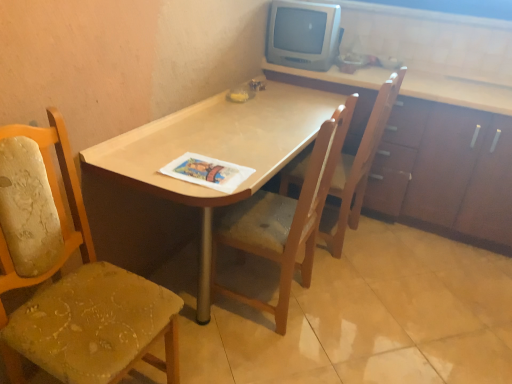
Identify the location of wooden chair at center, the third chair viewed from the left. (360, 164).

The width and height of the screenshot is (512, 384). I want to click on light wood desk at center, so click(x=215, y=152).

What do you see at coordinates (207, 172) in the screenshot? I see `printed paper magazine at center` at bounding box center [207, 172].

At what (x,y) coordinates should I click in order to perform the action: click on wooden chair at center, which is the 2th chair from left to right. Please return your answer as a coordinate pair (x, y). The width and height of the screenshot is (512, 384). Looking at the image, I should click on [285, 220].

Find the location of a particular element. The image size is (512, 384). wooden chair at center, the third chair viewed from the left is located at coordinates (360, 164).

Consider the image. Is light wood desk at center oriented away from worn fabric chair at left, which appears as the 1th chair when viewed from the left?

No, worn fabric chair at left, which appears as the 1th chair when viewed from the left, is not at the back of light wood desk at center.

Can you confirm if light wood desk at center is shorter than worn fabric chair at left, which appears as the 1th chair when viewed from the left?

Yes.

Which is correct: light wood desk at center is inside worn fabric chair at left, which appears as the 1th chair when viewed from the left, or outside of it?

light wood desk at center lies outside worn fabric chair at left, which appears as the 1th chair when viewed from the left.

Between wooden chair at center, which is counted as the second chair, starting from the right, and printed paper magazine at center, which one has smaller size?

Smaller between the two is printed paper magazine at center.

Where is `chair that is the 1st object located below the printed paper magazine at center (from the image's perspective)`? chair that is the 1st object located below the printed paper magazine at center (from the image's perspective) is located at coordinates pyautogui.click(x=285, y=220).

From a real-world perspective, which object rests below the other?

A: wooden chair at center, which is the 2th chair from left to right, is physically lower.

Is wooden chair at center, which is the 2th chair from left to right, positioned beyond the bounds of printed paper magazine at center?

Yes.

Consider the image. Does printed paper magazine at center come in front of wooden chair at center, placed as the 1th chair when sorted from right to left?

That is True.

The image size is (512, 384). I want to click on magazine that appears above the wooden chair at center, placed as the 1th chair when sorted from right to left (from a real-world perspective), so click(x=207, y=172).

Can you tell me how much printed paper magazine at center and wooden chair at center, the third chair viewed from the left, differ in facing direction?

The angular difference between printed paper magazine at center and wooden chair at center, the third chair viewed from the left, is 176 degrees.

Which is behind, point (383, 91) or point (226, 162)?

Positioned behind is point (383, 91).

Is printed paper magazine at center located within wooden chair at center, placed as the 1th chair when sorted from right to left?

No, printed paper magazine at center is located outside of wooden chair at center, placed as the 1th chair when sorted from right to left.

Can you confirm if wooden chair at center, the third chair viewed from the left, is positioned to the right of printed paper magazine at center?

Indeed, wooden chair at center, the third chair viewed from the left, is positioned on the right side of printed paper magazine at center.

Does wooden chair at center, the third chair viewed from the left, have a greater width compared to printed paper magazine at center?

Yes, wooden chair at center, the third chair viewed from the left, is wider than printed paper magazine at center.

Is worn fabric chair at left, which appears as the 1th chair when viewed from the left, aimed at wooden chair at center, which is the 2th chair from left to right?

No, worn fabric chair at left, which appears as the 1th chair when viewed from the left, is not turned towards wooden chair at center, which is the 2th chair from left to right.

Considering the points (100, 356) and (265, 248), which point is behind, point (100, 356) or point (265, 248)?

The point (265, 248) is behind.

Considering the positions of objects worn fabric chair at left, which is the 3th chair in right-to-left order, and wooden chair at center, which is the 2th chair from left to right, in the image provided, who is in front, worn fabric chair at left, which is the 3th chair in right-to-left order, or wooden chair at center, which is the 2th chair from left to right,?

Positioned in front is worn fabric chair at left, which is the 3th chair in right-to-left order.

Considering the sizes of objects worn fabric chair at left, which appears as the 1th chair when viewed from the left, and wooden chair at center, which is the 2th chair from left to right, in the image provided, who is smaller, worn fabric chair at left, which appears as the 1th chair when viewed from the left, or wooden chair at center, which is the 2th chair from left to right,?

worn fabric chair at left, which appears as the 1th chair when viewed from the left.

Considering the relative sizes of printed paper magazine at center and worn fabric chair at left, which is the 3th chair in right-to-left order, in the image provided, is printed paper magazine at center smaller than worn fabric chair at left, which is the 3th chair in right-to-left order,?

Indeed, printed paper magazine at center has a smaller size compared to worn fabric chair at left, which is the 3th chair in right-to-left order.

From the image's perspective, which is below, printed paper magazine at center or worn fabric chair at left, which is the 3th chair in right-to-left order?

worn fabric chair at left, which is the 3th chair in right-to-left order.

Considering the relative sizes of printed paper magazine at center and worn fabric chair at left, which appears as the 1th chair when viewed from the left, in the image provided, is printed paper magazine at center shorter than worn fabric chair at left, which appears as the 1th chair when viewed from the left,?

Indeed, printed paper magazine at center has a lesser height compared to worn fabric chair at left, which appears as the 1th chair when viewed from the left.

Which point is more forward, (200, 173) or (30, 161)?

Result: The point (30, 161) is closer to the camera.

Considering the sizes of wooden cabinet at upper right and printed paper magazine at center in the image, is wooden cabinet at upper right taller or shorter than printed paper magazine at center?

Clearly, wooden cabinet at upper right is taller compared to printed paper magazine at center.

Does point (437, 166) lie in front of point (227, 170)?

No, (437, 166) is behind (227, 170).

Is there a large distance between wooden cabinet at upper right and printed paper magazine at center?

Yes, wooden cabinet at upper right and printed paper magazine at center are quite far apart.

From the image's perspective, is wooden cabinet at upper right over printed paper magazine at center?

Correct, wooden cabinet at upper right appears higher than printed paper magazine at center in the image.

In the image, there is a worn fabric chair at left, which is the 3th chair in right-to-left order. Where is `desk above it (from the image's perspective)`? This screenshot has width=512, height=384. desk above it (from the image's perspective) is located at coordinates pos(215,152).

Starting from the printed paper magazine at center, which chair is the 1st one to the right? Please provide its 2D coordinates.

[(285, 220)]

Considering their positions, is printed paper magazine at center positioned closer to worn fabric chair at left, which is the 3th chair in right-to-left order, than light wood desk at center?

printed paper magazine at center is closer to worn fabric chair at left, which is the 3th chair in right-to-left order.

From the image, which object appears to be nearer to worn fabric chair at left, which is the 3th chair in right-to-left order, wooden chair at center, the third chair viewed from the left, or light wood desk at center?

light wood desk at center is positioned closer to the anchor worn fabric chair at left, which is the 3th chair in right-to-left order.

Which object lies nearer to the anchor point printed paper magazine at center, light wood desk at center or worn fabric chair at left, which is the 3th chair in right-to-left order?

The object closer to printed paper magazine at center is light wood desk at center.

Based on their spatial positions, is wooden chair at center, which is counted as the second chair, starting from the right, or light wood desk at center further from printed paper magazine at center?

→ wooden chair at center, which is counted as the second chair, starting from the right, is positioned further to the anchor printed paper magazine at center.

Considering their positions, is wooden chair at center, the third chair viewed from the left, positioned closer to printed paper magazine at center than wooden cabinet at upper right?

wooden chair at center, the third chair viewed from the left.

Based on the photo, which object lies further to the anchor point worn fabric chair at left, which is the 3th chair in right-to-left order, wooden chair at center, which is the 2th chair from left to right, or light wood desk at center?

The object further to worn fabric chair at left, which is the 3th chair in right-to-left order, is wooden chair at center, which is the 2th chair from left to right.

Looking at the image, which one is located closer to printed paper magazine at center, worn fabric chair at left, which is the 3th chair in right-to-left order, or light wood desk at center?

light wood desk at center is closer to printed paper magazine at center.

Estimate the real-world distances between objects in this image. Which object is further from wooden chair at center, which is counted as the second chair, starting from the right, wooden chair at center, placed as the 1th chair when sorted from right to left, or worn fabric chair at left, which is the 3th chair in right-to-left order?

worn fabric chair at left, which is the 3th chair in right-to-left order, is positioned further to the anchor wooden chair at center, which is counted as the second chair, starting from the right.

Image resolution: width=512 pixels, height=384 pixels. What are the coordinates of `desk situated between worn fabric chair at left, which appears as the 1th chair when viewed from the left, and wooden cabinet at upper right from left to right` in the screenshot? It's located at (215, 152).

Where is `desk between printed paper magazine at center and wooden chair at center, the third chair viewed from the left, from left to right`? The width and height of the screenshot is (512, 384). desk between printed paper magazine at center and wooden chair at center, the third chair viewed from the left, from left to right is located at coordinates (215, 152).

Identify the location of chair located between wooden chair at center, which is counted as the second chair, starting from the right, and wooden cabinet at upper right in the left-right direction. This screenshot has width=512, height=384. pos(360,164).

Identify the location of chair between printed paper magazine at center and wooden chair at center, placed as the 1th chair when sorted from right to left. The width and height of the screenshot is (512, 384). (285, 220).